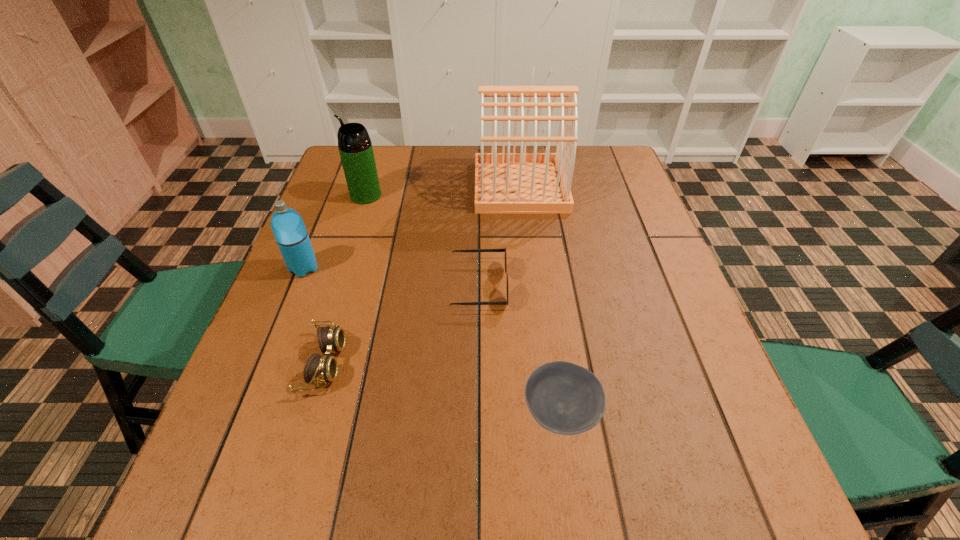
Locate an element on the screen. The width and height of the screenshot is (960, 540). object that is at the far left corner is located at coordinates (355, 147).

This screenshot has height=540, width=960. In order to click on vacant area at the far edge in this screenshot , I will do `click(411, 182)`.

Locate an element on the screen. The width and height of the screenshot is (960, 540). vacant region at the near edge of the desktop is located at coordinates (442, 523).

In the image, there is a desktop. In order to click on vacant space at the left edge in this screenshot , I will do `click(252, 409)`.

You are a GUI agent. You are given a task and a screenshot of the screen. Output one action in this format:
    pyautogui.click(x=<x>, y=<y>)
    Task: Click on the vacant position at the right edge of the desktop
    This screenshot has width=960, height=540.
    Given the screenshot: What is the action you would take?
    pyautogui.click(x=590, y=188)

Where is `vacant space at the far right corner`? vacant space at the far right corner is located at coordinates (580, 164).

What are the coordinates of `vacant space at the near right corner of the desktop` in the screenshot? It's located at (750, 535).

You are a GUI agent. You are given a task and a screenshot of the screen. Output one action in this format:
    pyautogui.click(x=<x>, y=<y>)
    Task: Click on the vacant point located between the taller thermos bottle and the birdcage
    The width and height of the screenshot is (960, 540).
    Given the screenshot: What is the action you would take?
    [444, 191]

Identify the location of vacant point located between the goggles and the bowl. (443, 388).

Find the location of a particular element. This screenshot has height=540, width=960. unoccupied area between the sunglasses and the nearer thermos bottle is located at coordinates (392, 277).